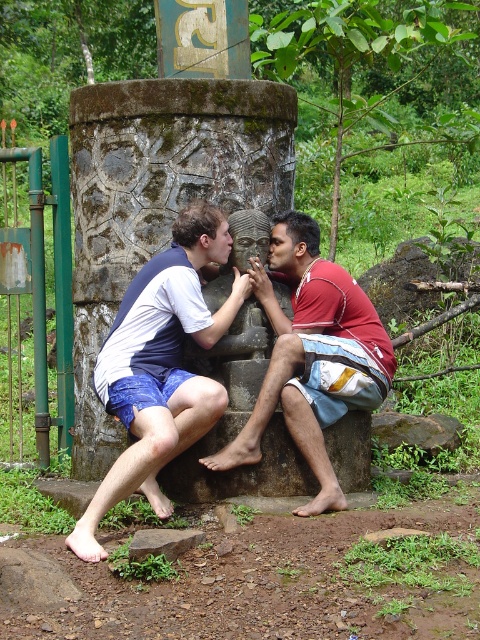
Question: Is the position of blue denim shorts at left less distant than that of brown rough rock at lower center?

Choices:
 (A) yes
 (B) no

Answer: (B)

Question: Which point is farther to the camera?

Choices:
 (A) blue denim shorts at left
 (B) carved stone pillar at center
 (C) brown rough rock at lower center

Answer: (B)

Question: Can you confirm if reddish-brown fabric shorts at center is positioned above brown rough rock at lower center?

Choices:
 (A) yes
 (B) no

Answer: (A)

Question: Which object is the closest to the brown rough rock at lower center?

Choices:
 (A) blue denim shorts at left
 (B) carved stone pillar at center
 (C) reddish-brown fabric shorts at center

Answer: (A)

Question: Does carved stone pillar at center lie behind reddish-brown fabric shorts at center?

Choices:
 (A) no
 (B) yes

Answer: (B)

Question: Which object is farther from the camera taking this photo?

Choices:
 (A) blue denim shorts at left
 (B) reddish-brown fabric shorts at center
 (C) brown rough rock at lower center

Answer: (B)